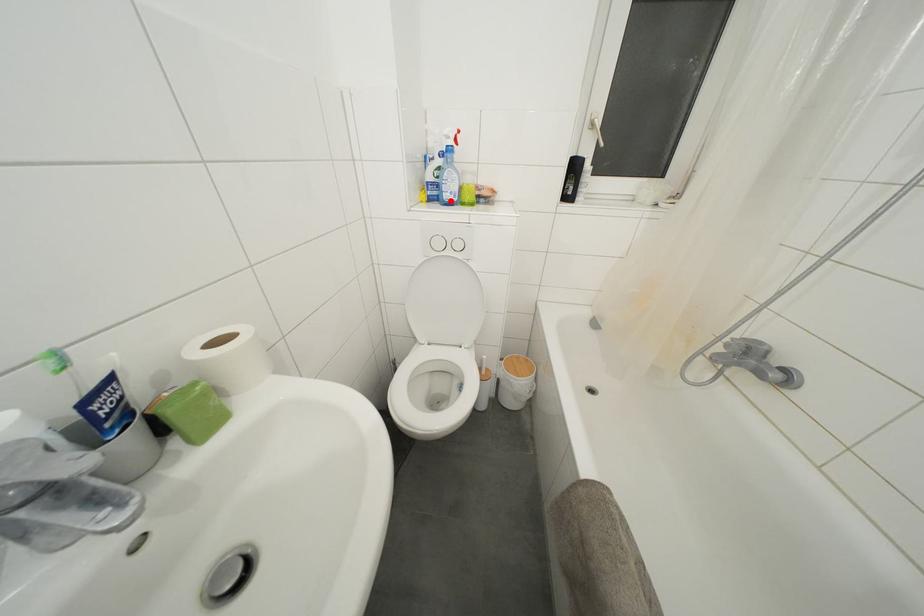
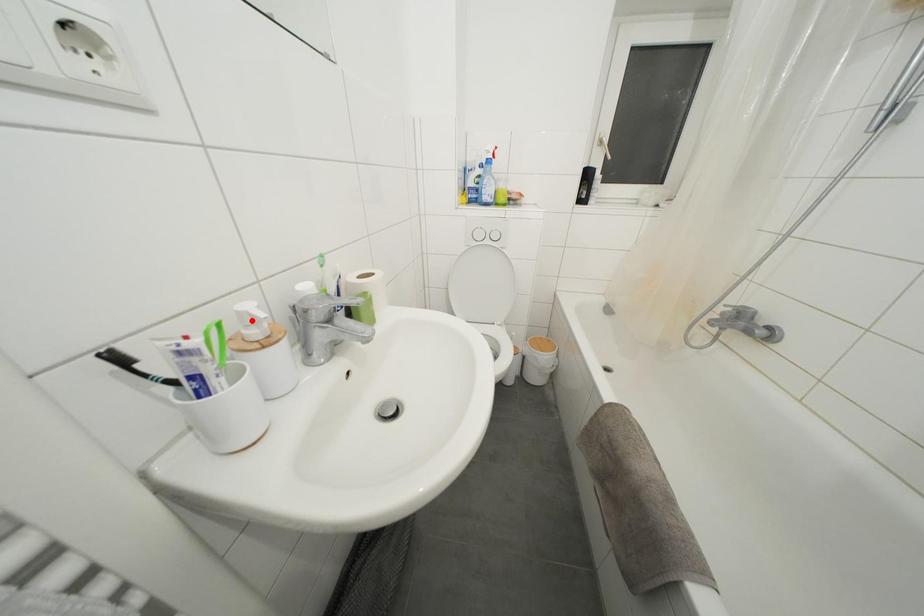
I am providing you with two images of the same scene from different viewpoints. A red point is marked on the first image and another point is marked on the second image. Is the marked point in image1 the same physical position as the marked point in image2?

No